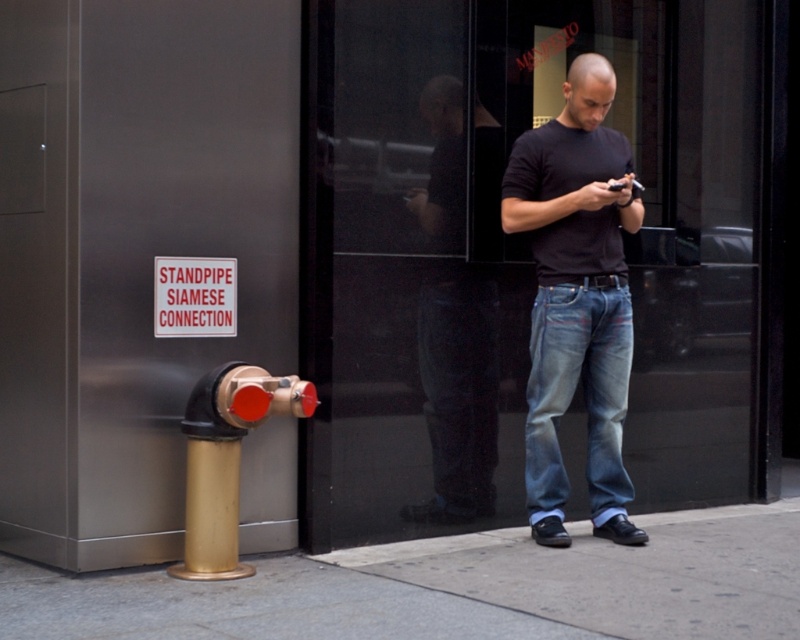
You are a delivery person who needs to deliver a package to the address located at point (576, 298). The address is marked by a specific object. Which object should you look for?

The address at point (576, 298) is marked by the matte black shirt at center.

You are a delivery person who needs to locate the STANDPIPE SIAMESE CONNECTION sign. You see the matte black shirt at center and the gold metallic hydrant at lower left. Which object is closer to the sign?

The gold metallic hydrant at lower left is closer to the sign because it is positioned to the left of the matte black shirt at center, which is to the right of it.